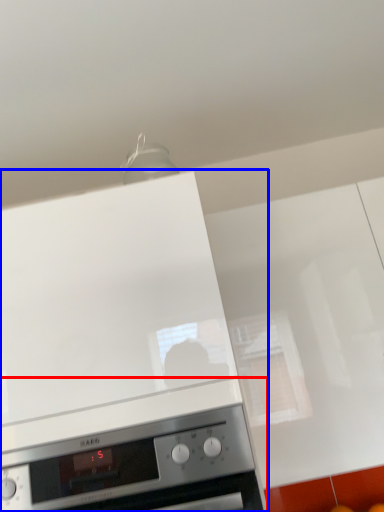
Question: Which object appears closest to the camera in this image, home appliance (highlighted by a red box) or home appliance (highlighted by a blue box)?

Choices:
 (A) home appliance
 (B) home appliance

Answer: (A)